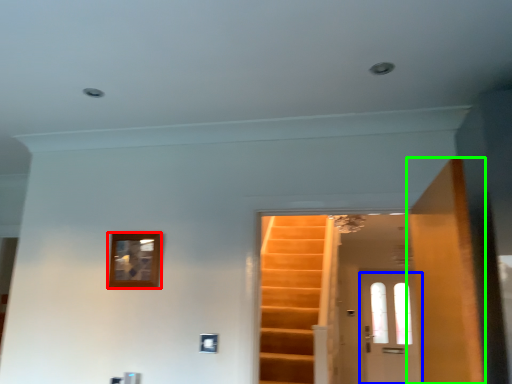
Question: Estimate the real-world distances between objects in this image. Which object is closer to picture frame (highlighted by a red box), door (highlighted by a blue box) or door (highlighted by a green box)?

Choices:
 (A) door
 (B) door

Answer: (B)